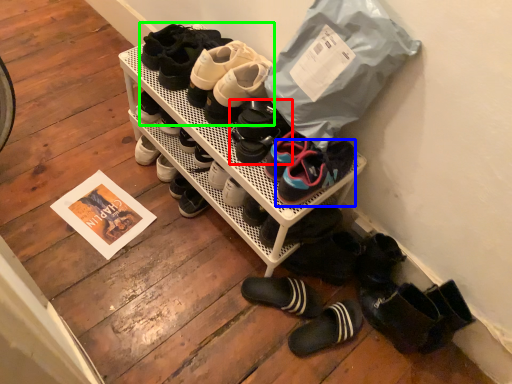
Question: Based on their relative distances, which object is farther from footwear (highlighted by a red box)? Choose from footwear (highlighted by a blue box) and footwear (highlighted by a green box).

Choices:
 (A) footwear
 (B) footwear

Answer: (B)